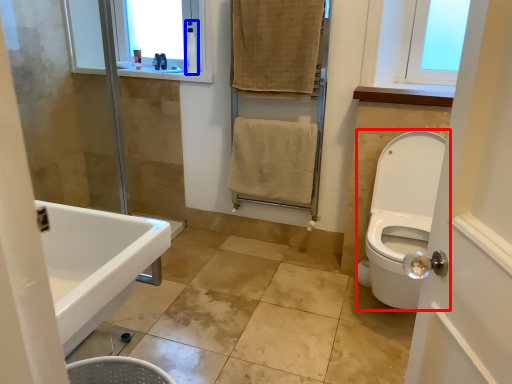
Question: Which of the following is the farthest to the observer, toilet (highlighted by a red box) or toiletry (highlighted by a blue box)?

Choices:
 (A) toilet
 (B) toiletry

Answer: (B)